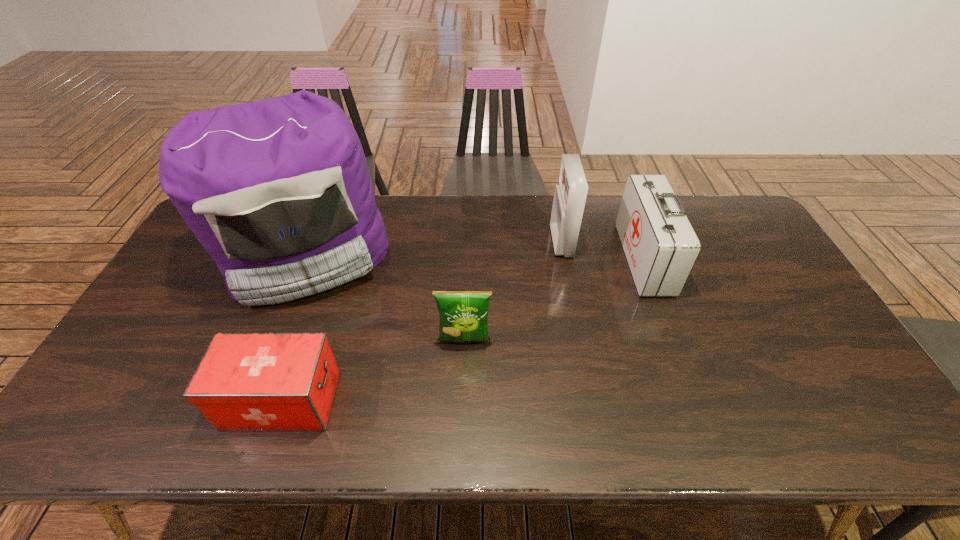
Find the location of a particular element. The height and width of the screenshot is (540, 960). object located at the left edge is located at coordinates (278, 192).

The image size is (960, 540). Find the location of `object present at the far left corner`. object present at the far left corner is located at coordinates pos(278,192).

The width and height of the screenshot is (960, 540). I want to click on vacant position at the far edge of the desktop, so click(x=514, y=221).

Find the location of a particular element. free location at the near edge is located at coordinates (556, 417).

This screenshot has width=960, height=540. I want to click on vacant space at the left edge, so click(157, 318).

Identify the location of free space at the near left corner of the desktop. (x=134, y=410).

In the image, there is a desktop. What are the coordinates of `free region at the near right corner` in the screenshot? It's located at (878, 409).

The image size is (960, 540). I want to click on free space between the fourth farthest object and the fourth shortest object, so click(513, 291).

At what (x,y) coordinates should I click in order to perform the action: click on vacant region between the third object from right to left and the leftmost first-aid kit. Please return your answer as a coordinate pair (x, y). The image size is (960, 540). Looking at the image, I should click on (373, 370).

Image resolution: width=960 pixels, height=540 pixels. Identify the location of empty space between the tallest object and the second nearest object. (386, 299).